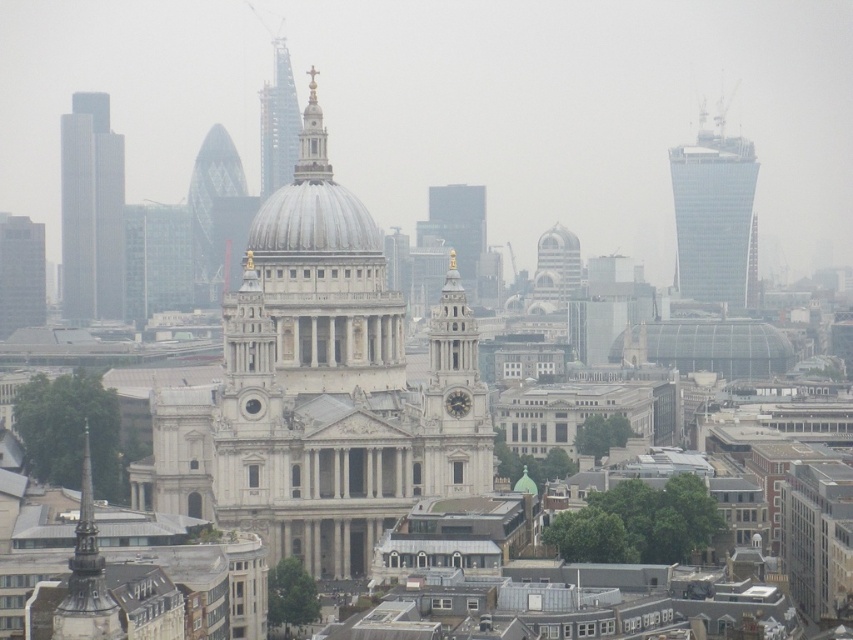
Between goldmaterial/texturespire at center and white marble clock at center, which one has more height?

goldmaterial/texturespire at center is taller.

Is point (323, 140) closer to viewer compared to point (451, 403)?

No, (323, 140) is further to viewer.

Identify the location of goldmaterial/texturespire at center. The width and height of the screenshot is (853, 640). (312, 140).

Does glassy steel skyscraper at upper right have a lesser height compared to white stone clock tower at center?

In fact, glassy steel skyscraper at upper right may be taller than white stone clock tower at center.

What do you see at coordinates (712, 212) in the screenshot? I see `glassy steel skyscraper at upper right` at bounding box center [712, 212].

Is point (709, 173) farther from camera compared to point (453, 358)?

Yes, point (709, 173) is farther from viewer.

Where is `glassy steel skyscraper at upper right`? Image resolution: width=853 pixels, height=640 pixels. glassy steel skyscraper at upper right is located at coordinates (712, 212).

Does smooth glass skyscraper at left have a lesser height compared to white marble clock at center?

Incorrect, smooth glass skyscraper at left's height does not fall short of white marble clock at center's.

Which is more to the right, smooth glass skyscraper at left or white marble clock at center?

Positioned to the right is white marble clock at center.

Who is more distant from viewer, (80, 120) or (451, 394)?

The point (80, 120) is behind.

You are a GUI agent. You are given a task and a screenshot of the screen. Output one action in this format:
    pyautogui.click(x=<x>, y=<y>)
    Task: Click on the smooth glass skyscraper at left
    The height and width of the screenshot is (640, 853).
    Given the screenshot: What is the action you would take?
    pyautogui.click(x=91, y=211)